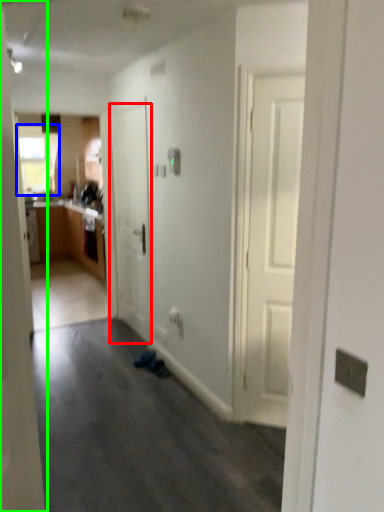
Question: Estimate the real-world distances between objects in this image. Which object is farther from door (highlighted by a red box), window (highlighted by a blue box) or door (highlighted by a green box)?

Choices:
 (A) window
 (B) door

Answer: (A)